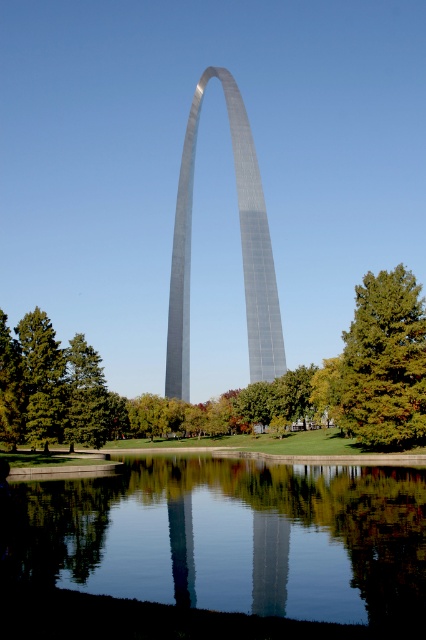
You are planning to install a new pathway between the transparent glass water at center and the green matte tree at lower left. The pathway needs to be 80 feet long to accommodate all visitors. Based on the scene, will the existing space between them be sufficient for this pathway?

The distance between the transparent glass water at center and the green matte tree at lower left is 78.69 feet, which is slightly shorter than the required 80 feet. Therefore, the existing space is insufficient to accommodate the 80 feet long pathway.

You are planning to take a photo of the shiny metallic arch at center and the green matte tree at lower left. To ensure both are fully visible in the frame, which object should you focus on first, the one closer to you or the one further away?

The shiny metallic arch at center is wider than the green matte tree at lower left, so you should focus on the object further away to ensure both are in focus.

You are a photographer planning to capture the Gateway Arch and its reflection. You have a camera with a 30cm wide frame. The transparent glass water at center and green matte tree at lower right are both in your shot. Which object will occupy more space in your photo?

The transparent glass water at center will occupy more space in the photo because it is bigger than the green matte tree at lower right according to the description.